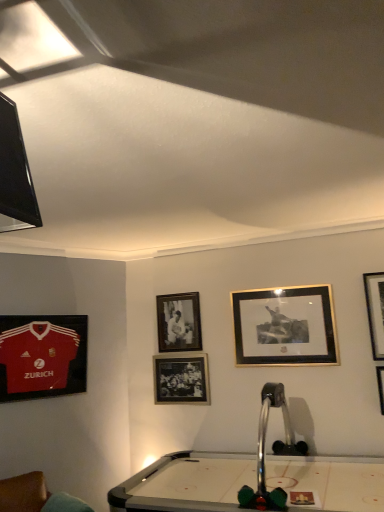
Question: Looking at the image, does gold/black picture frame at upper center, which is the 4th picture frame from left to right, seem bigger or smaller compared to matte jersey at left, positioned as the first picture frame in left-to-right order?

Choices:
 (A) big
 (B) small

Answer: (B)

Question: Considering the positions of gold/black picture frame at upper center, which is the 4th picture frame from left to right, and matte jersey at left, the fifth picture frame viewed from the right, in the image, is gold/black picture frame at upper center, which is the 4th picture frame from left to right, taller or shorter than matte jersey at left, the fifth picture frame viewed from the right,?

Choices:
 (A) tall
 (B) short

Answer: (B)

Question: Estimate the real-world distances between objects in this image. Which object is farther from the matte jersey at left, the fifth picture frame viewed from the right?

Choices:
 (A) gold-framed picture at upper right, which is counted as the first picture frame, starting from the right
 (B) matte black picture frame at center, the third picture frame in the left-to-right sequence
 (C) metallic silver billiard table at center
 (D) black matte picture frame at center, which is the fourth picture frame from right to left
 (E) gold/black picture frame at upper center, which is the 4th picture frame from left to right

Answer: (A)

Question: Which object is positioned closest to the black matte picture frame at center, which is the fourth picture frame from right to left?

Choices:
 (A) matte black picture frame at center, which is the 3th picture frame from right to left
 (B) gold/black picture frame at upper center, the second picture frame viewed from the right
 (C) gold-framed picture at upper right, which is counted as the first picture frame, starting from the right
 (D) matte jersey at left, the fifth picture frame viewed from the right
 (E) metallic silver billiard table at center

Answer: (A)